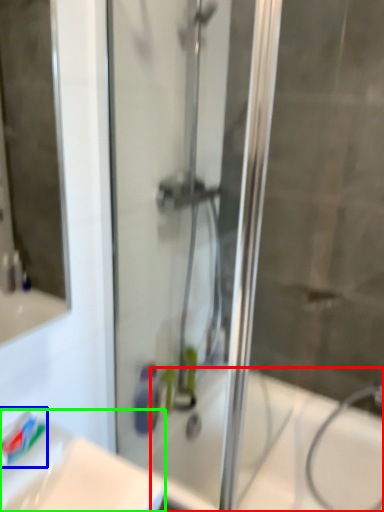
Question: Which object is positioned closest to bath (highlighted by a red box)? Select from toothpaste (highlighted by a blue box) and sink (highlighted by a green box).

Choices:
 (A) toothpaste
 (B) sink

Answer: (B)